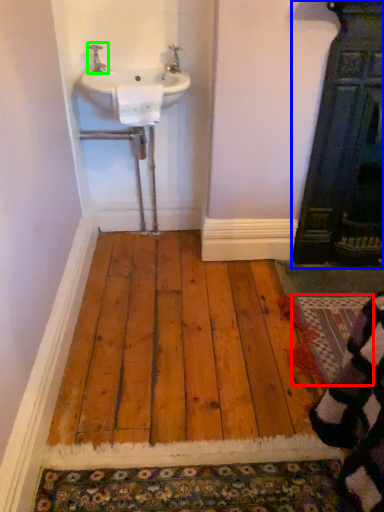
Question: Based on their relative distances, which object is nearer to doormat (highlighted by a red box)? Choose from door (highlighted by a blue box) and tap (highlighted by a green box).

Choices:
 (A) door
 (B) tap

Answer: (A)